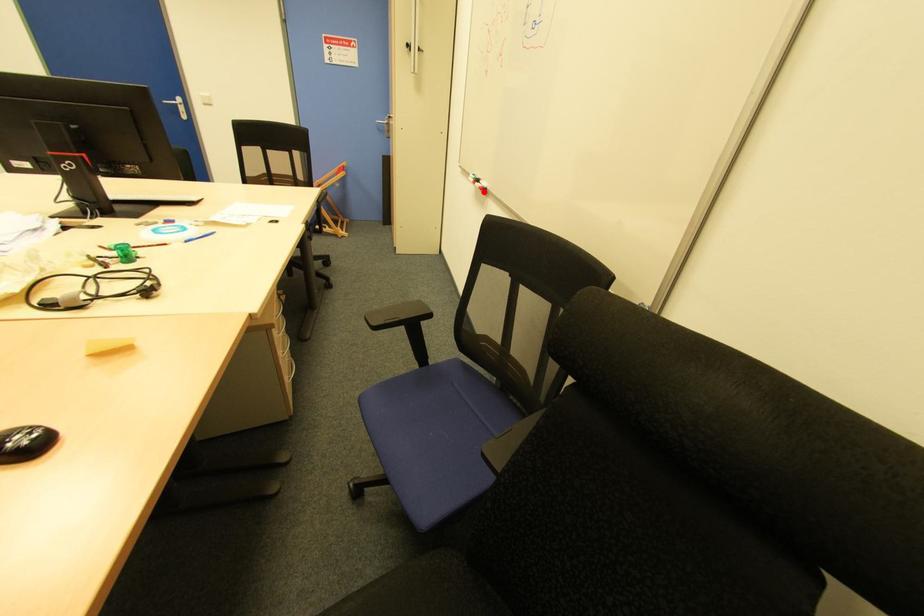
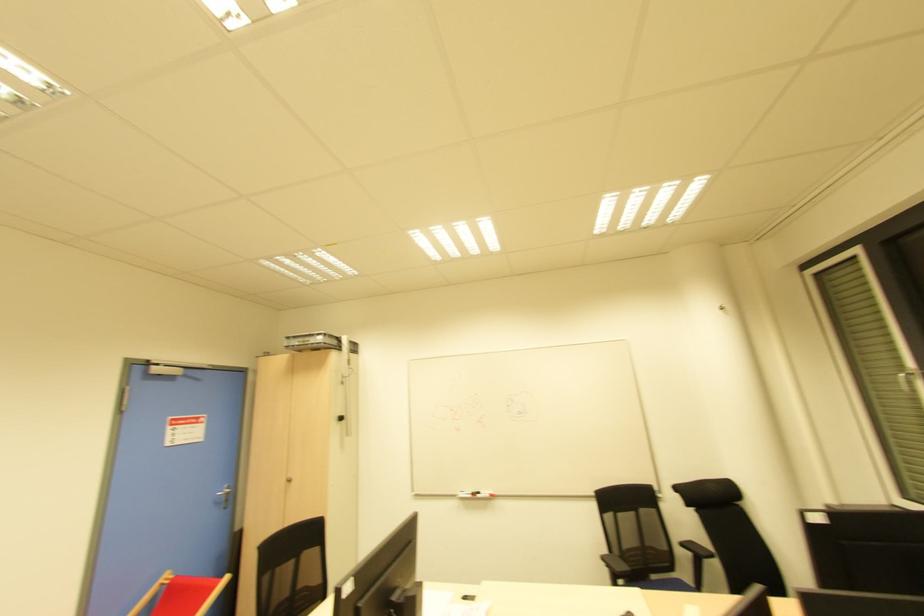
Question: I am providing you with two images of the same scene from different viewpoints. Image1 has a red point marked. In image2, the corresponding 3D location appears at what relative position? Reply with the corresponding letter.

Choices:
 (A) Closer
 (B) Farther

Answer: (B)